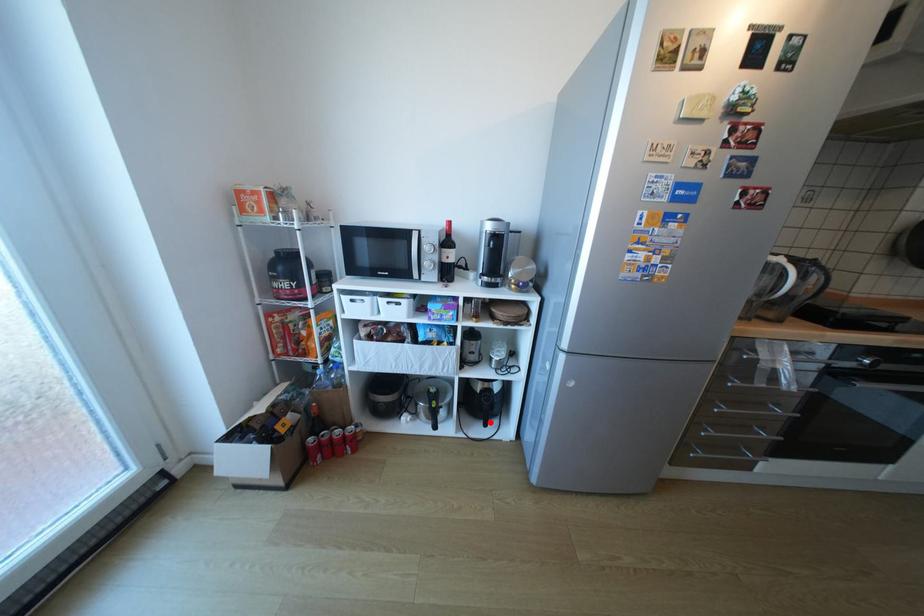
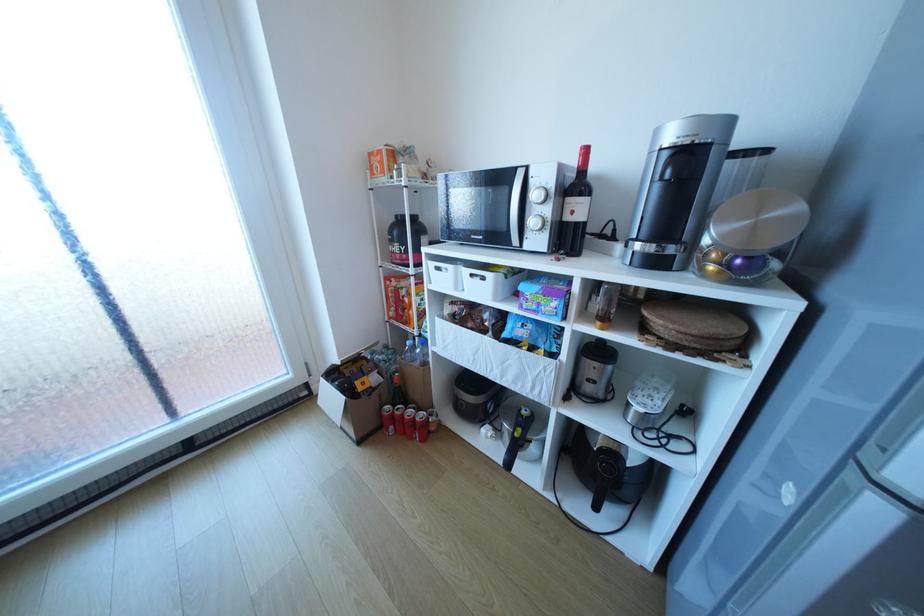
In the second image, find the point that corresponds to the highlighted location in the first image.

(599, 499)